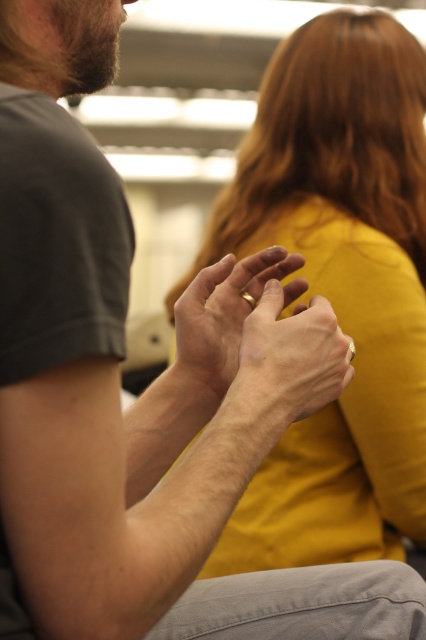
Consider the image. Is the position of mustard yellow fabric at upper right more distant than that of matte gold ring at center?

Yes.

This screenshot has width=426, height=640. What do you see at coordinates (337, 289) in the screenshot?
I see `mustard yellow fabric at upper right` at bounding box center [337, 289].

Which is behind, point (374, 52) or point (213, 305)?

Positioned behind is point (374, 52).

This screenshot has width=426, height=640. Identify the location of mustard yellow fabric at upper right. (337, 289).

Can you confirm if mustard yellow fabric at upper right is positioned below smooth skin hands at center?

No, mustard yellow fabric at upper right is not below smooth skin hands at center.

Does mustard yellow fabric at upper right come behind smooth skin hands at center?

Yes.

Is point (389, 200) positioned in front of point (250, 387)?

That is False.

Find the location of a particular element. The height and width of the screenshot is (640, 426). mustard yellow fabric at upper right is located at coordinates (337, 289).

Which of these two, smooth skin hands at center or matte gold ring at center, stands taller?

Standing taller between the two is matte gold ring at center.

Measure the distance between point [290,346] and camera.

Point [290,346] and camera are 28.56 inches apart.

You are a GUI agent. You are given a task and a screenshot of the screen. Output one action in this format:
    pyautogui.click(x=<x>, y=<y>)
    Task: Click on the smooth skin hands at center
    This screenshot has height=640, width=426.
    Given the screenshot: What is the action you would take?
    pyautogui.click(x=287, y=362)